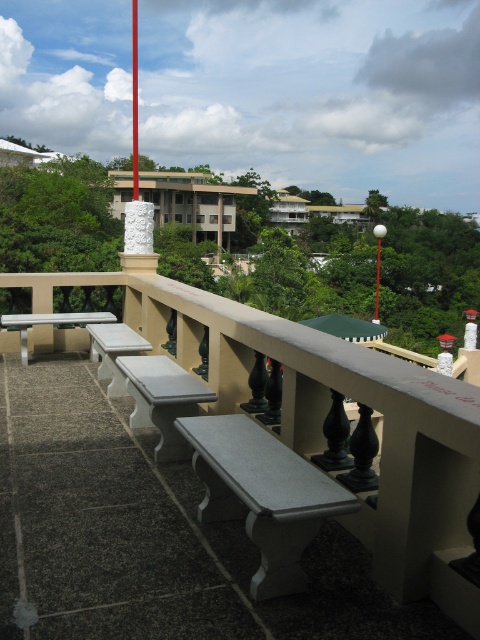
You are planning to place a large potted plant between the white marble bench at lower left and the smooth red flag pole at center on the balcony. Given their sizes, will there be enough space for the plant?

The white marble bench at lower left has a smaller size compared to the smooth red flag pole at center, so there should be sufficient space between them to place a large potted plant.

You are standing on the balcony and want to place a small potted plant between the white marble bench at lower left and the smooth red flag pole at center. Since you want the plant to be as close as possible to the flag pole, where should you place it?

The white marble bench at lower left is closer to the viewer than the smooth red flag pole at center, so to place the plant as close as possible to the flag pole, you should position it near the smooth red flag pole at center.